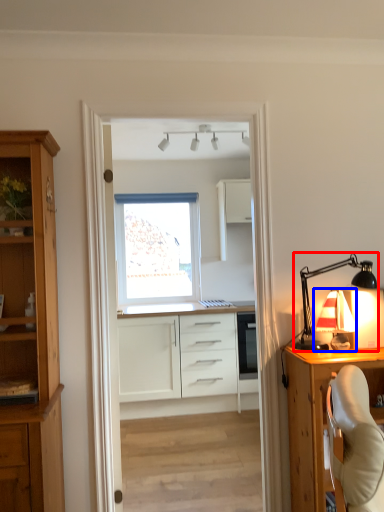
Question: Which object appears farthest to the camera in this image, lamp (highlighted by a red box) or table lamp (highlighted by a blue box)?

Choices:
 (A) lamp
 (B) table lamp

Answer: (B)